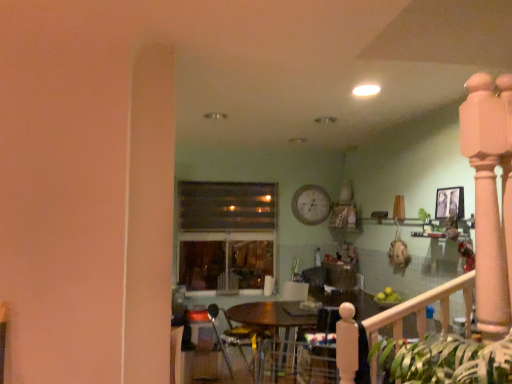
Question: Which is correct: velvet dark blue armchair at center, the second armchair positioned from the left, is inside wooden table at center, or outside of it?

Choices:
 (A) inside
 (B) outside

Answer: (A)

Question: Considering their positions, is velvet dark blue armchair at center, the first armchair when ordered from right to left, located in front of or behind wooden table at center?

Choices:
 (A) front
 (B) behind

Answer: (A)

Question: Based on their relative distances, which object is nearer to the wooden table at center?

Choices:
 (A) metallic silver armchair at center, which ranks as the first armchair in left-to-right order
 (B) velvet dark blue armchair at center, the second armchair positioned from the left
 (C) transparent glass window at center
 (D) white wooden clock at upper center

Answer: (B)

Question: Based on their relative distances, which object is nearer to the white wooden clock at upper center?

Choices:
 (A) velvet dark blue armchair at center, the first armchair when ordered from right to left
 (B) transparent glass window at center
 (C) metallic silver armchair at center, the 2th armchair positioned from the right
 (D) wooden table at center

Answer: (B)